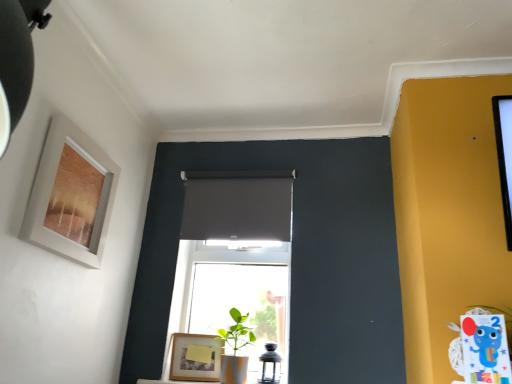
Question: From the image's perspective, relative to green matte plant at center, is transparent glass lantern at center above or below?

Choices:
 (A) below
 (B) above

Answer: (A)

Question: From a real-world perspective, relative to green matte plant at center, is transparent glass lantern at center vertically above or below?

Choices:
 (A) below
 (B) above

Answer: (A)

Question: Considering the real-world distances, which object is closest to the transparent glass lantern at center?

Choices:
 (A) green matte plant at center
 (B) green matte plant pot at center
 (C) wooden frame at lower center, marked as the second picture frame in a left-to-right arrangement
 (D) matte white picture frame at upper left, which ranks as the 1th picture frame in top-to-bottom order
 (E) matte gray curtain at center

Answer: (B)

Question: Based on their relative distances, which object is farther from the green matte plant pot at center?

Choices:
 (A) matte gray curtain at center
 (B) transparent glass lantern at center
 (C) green matte plant at center
 (D) wooden frame at lower center, which is the 2th picture frame in front-to-back order
 (E) matte white picture frame at upper left, which ranks as the 1th picture frame in top-to-bottom order

Answer: (C)